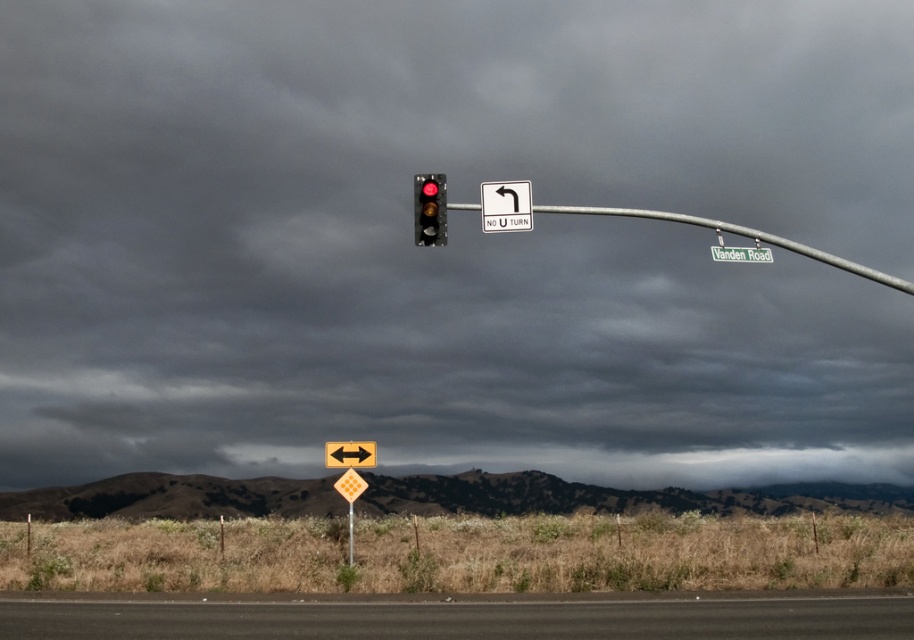
Which is more to the right, white plastic sign at upper center or matte black traffic light at upper center?

Positioned to the right is white plastic sign at upper center.

You are a GUI agent. You are given a task and a screenshot of the screen. Output one action in this format:
    pyautogui.click(x=<x>, y=<y>)
    Task: Click on the white plastic sign at upper center
    The height and width of the screenshot is (640, 914).
    Given the screenshot: What is the action you would take?
    [505, 205]

Can you confirm if matte black traffic light at upper center is positioned below yellow diamond at center?

No.

Which is behind, point (434, 243) or point (326, 442)?

The point (326, 442) is behind.

Does point (427, 182) lie in front of point (364, 454)?

Yes, it is in front of point (364, 454).

I want to click on matte black traffic light at upper center, so click(429, 209).

Is white plastic sign at upper center to the right of green plastic street sign at upper center from the viewer's perspective?

In fact, white plastic sign at upper center is to the left of green plastic street sign at upper center.

Does white plastic sign at upper center lie behind green plastic street sign at upper center?

Yes.

Between point (485, 209) and point (771, 252), which one is positioned behind?

Positioned behind is point (771, 252).

Find the location of a particular element. The width and height of the screenshot is (914, 640). white plastic sign at upper center is located at coordinates [505, 205].